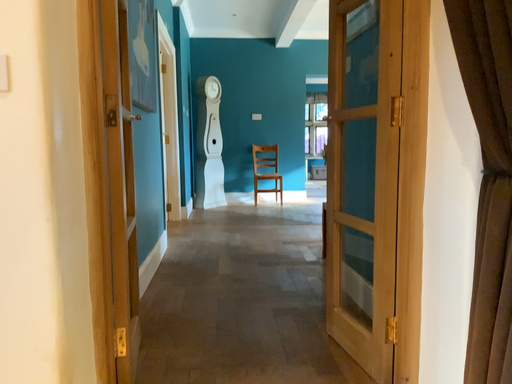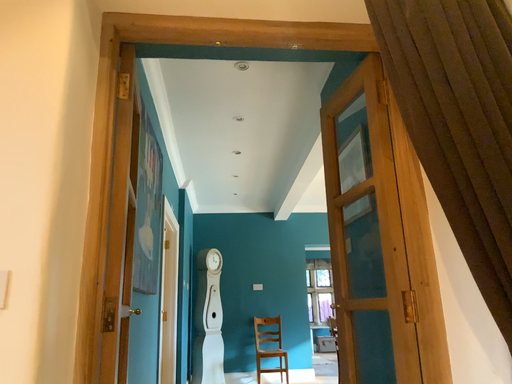
Question: Which way did the camera rotate in the video?

Choices:
 (A) rotated upward
 (B) rotated downward

Answer: (A)